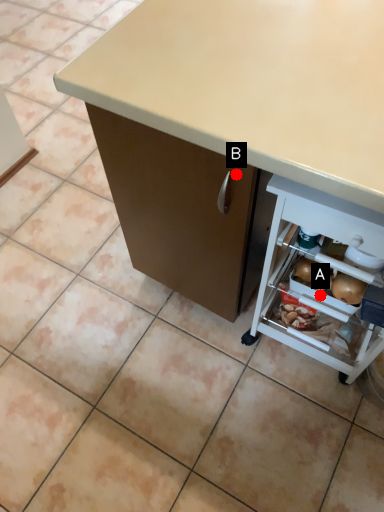
Question: Two points are circled on the image, labeled by A and B beside each circle. Which point is farther from the camera taking this photo?

Choices:
 (A) A is further
 (B) B is further

Answer: (A)